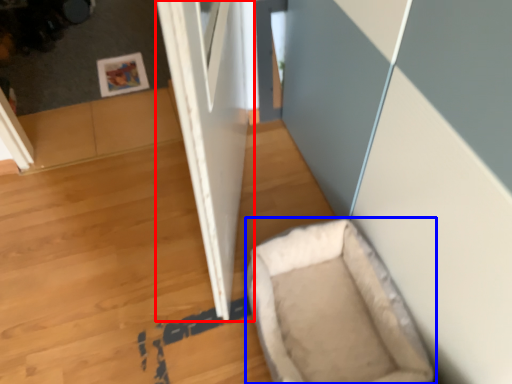
Question: Which object appears closest to the camera in this image, door (highlighted by a red box) or dog bed (highlighted by a blue box)?

Choices:
 (A) door
 (B) dog bed

Answer: (A)